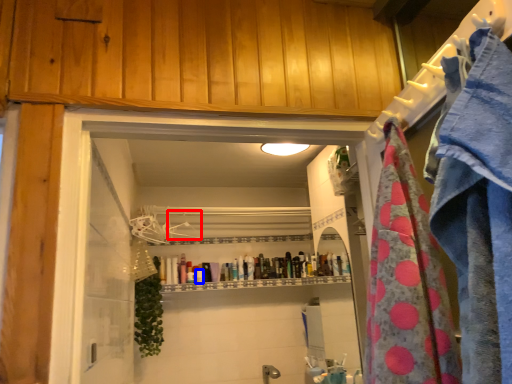
Question: Which point is closer to the camera, hanger (highlighted by a red box) or toiletry (highlighted by a blue box)?

Choices:
 (A) hanger
 (B) toiletry

Answer: (A)